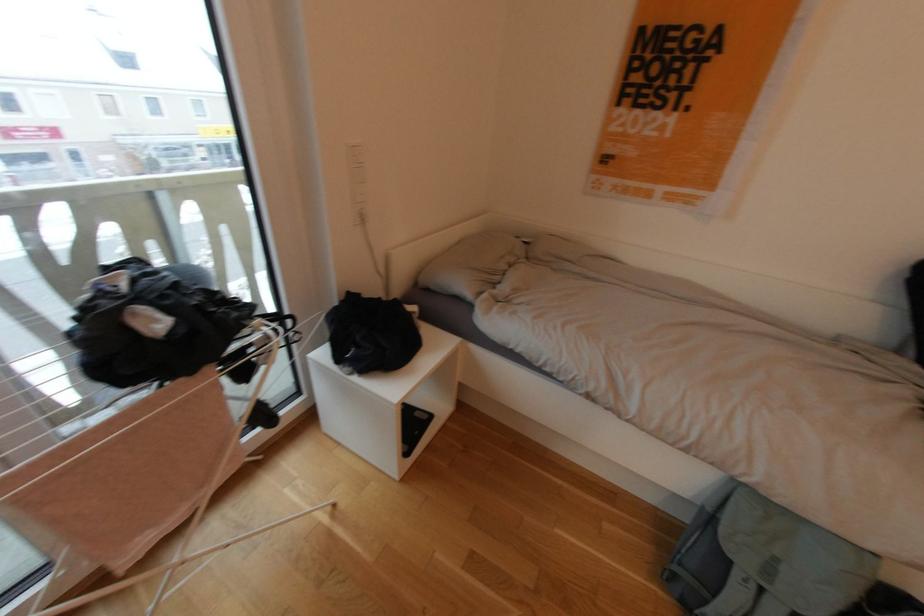
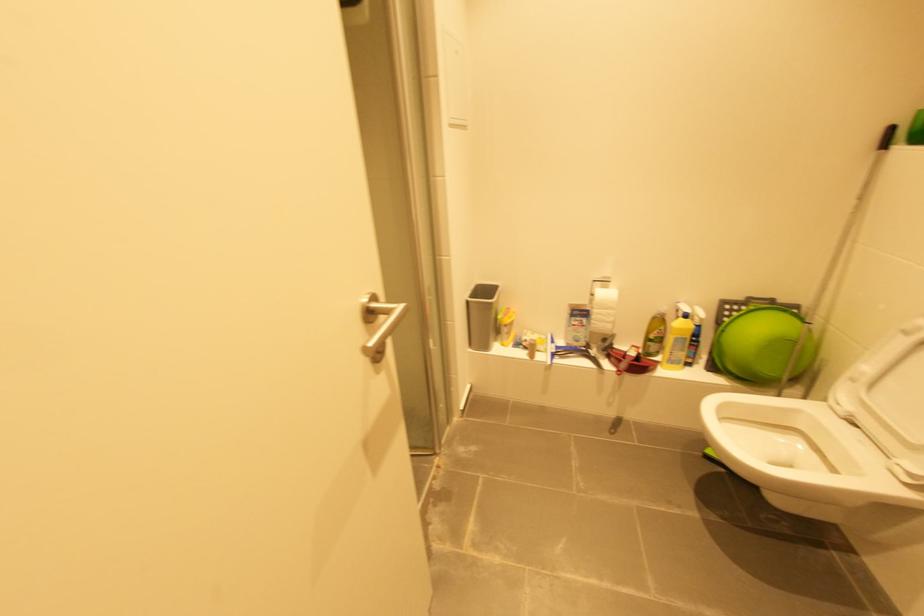
What movement of the cameraman would produce the second image?

The movement direction of the cameraman is right, backward.